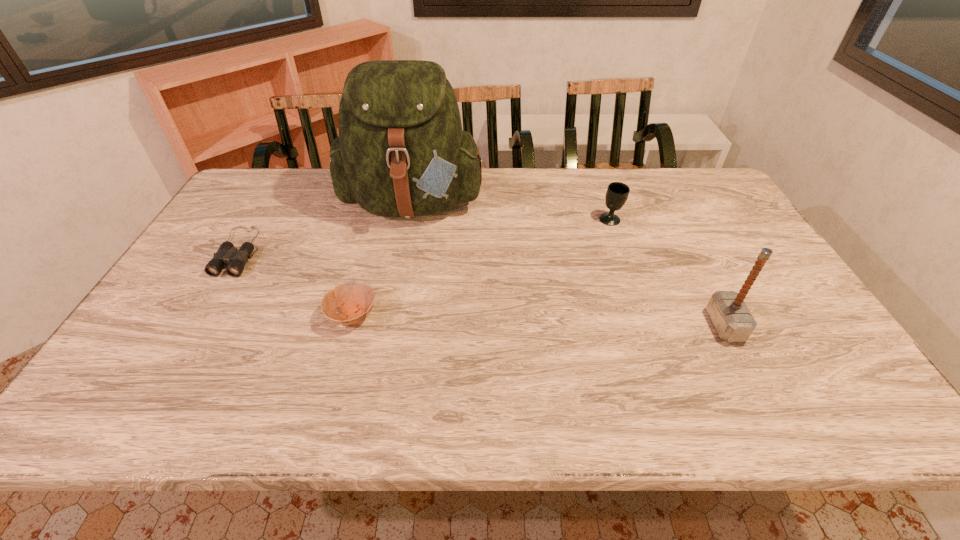
Image resolution: width=960 pixels, height=540 pixels. In the image, there is a desktop. What are the coordinates of `blank space at the right edge` in the screenshot? It's located at (834, 366).

What are the coordinates of `vacant area at the near right corner` in the screenshot? It's located at point(819,403).

Locate an element on the screen. Image resolution: width=960 pixels, height=540 pixels. free space between the fourth object from left to right and the backpack is located at coordinates (513, 211).

The width and height of the screenshot is (960, 540). Identify the location of free space between the tallest object and the shortest object. (326, 227).

Identify the location of free space that is in between the hammer and the backpack. (569, 264).

The width and height of the screenshot is (960, 540). I want to click on blank region between the chalice and the leftmost object, so click(424, 235).

Identify the location of vacant space that's between the third shortest object and the tallest object. (513, 211).

You are a GUI agent. You are given a task and a screenshot of the screen. Output one action in this format:
    pyautogui.click(x=<x>, y=<y>)
    Task: Click on the free space between the leftmost object and the chalice
    The height and width of the screenshot is (540, 960).
    Given the screenshot: What is the action you would take?
    pyautogui.click(x=424, y=235)

Locate an element on the screen. free space that is in between the fourth object from left to right and the binoculars is located at coordinates (424, 235).

Image resolution: width=960 pixels, height=540 pixels. Identify the location of vacant area that lies between the fourth shortest object and the bowl. point(539,320).